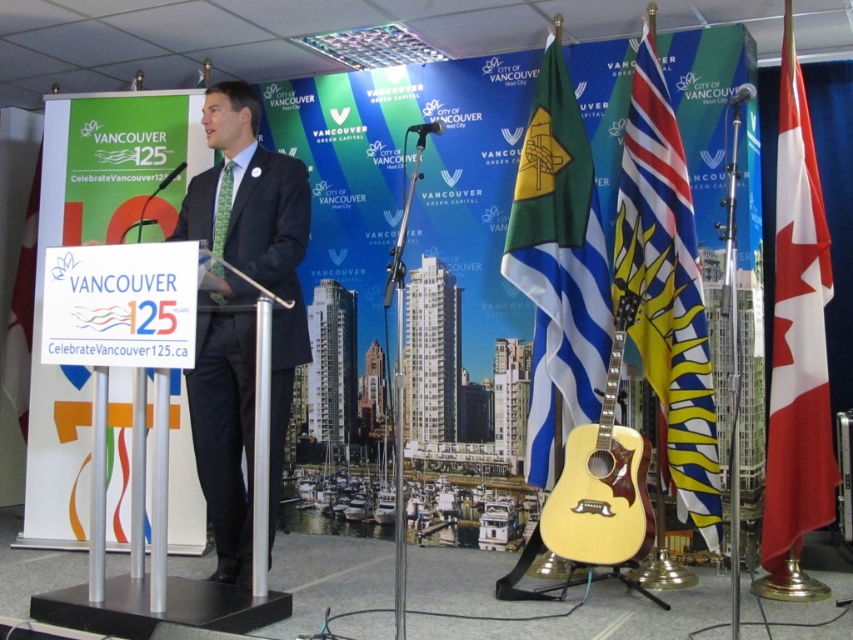
You are standing at the point labeled point (569,129). You need to walk to the point labeled point (689,256). Which direction should you move in to reach your destination?

Since point (569,129) is behind point (689,256), you should move forward to reach point (689,256) from your current position at point (569,129).